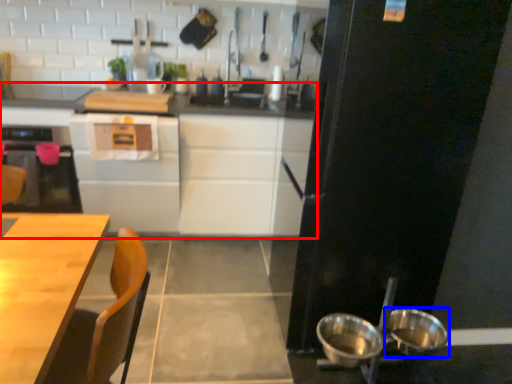
Question: Among these objects, which one is farthest to the camera, cabinetry (highlighted by a red box) or bowl (highlighted by a blue box)?

Choices:
 (A) cabinetry
 (B) bowl

Answer: (A)